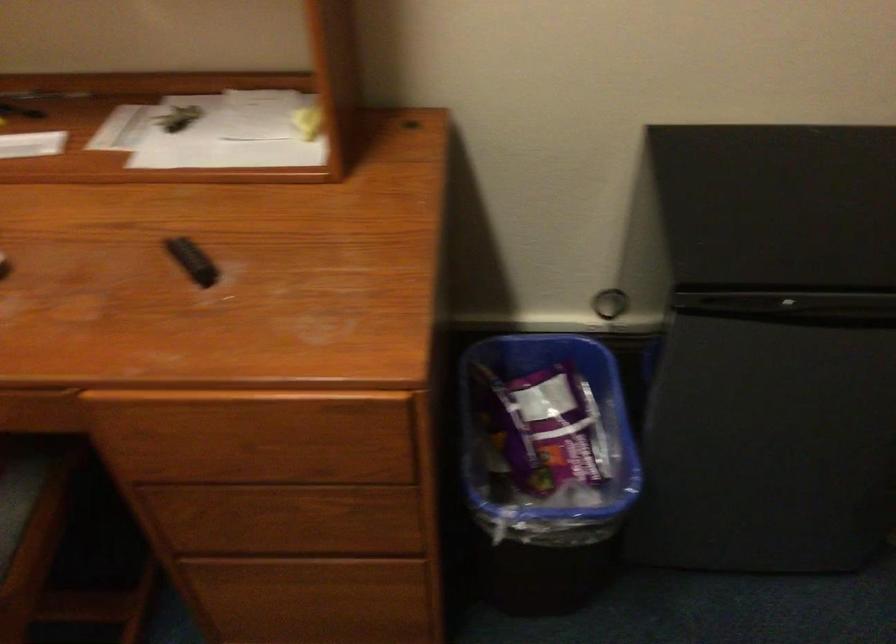
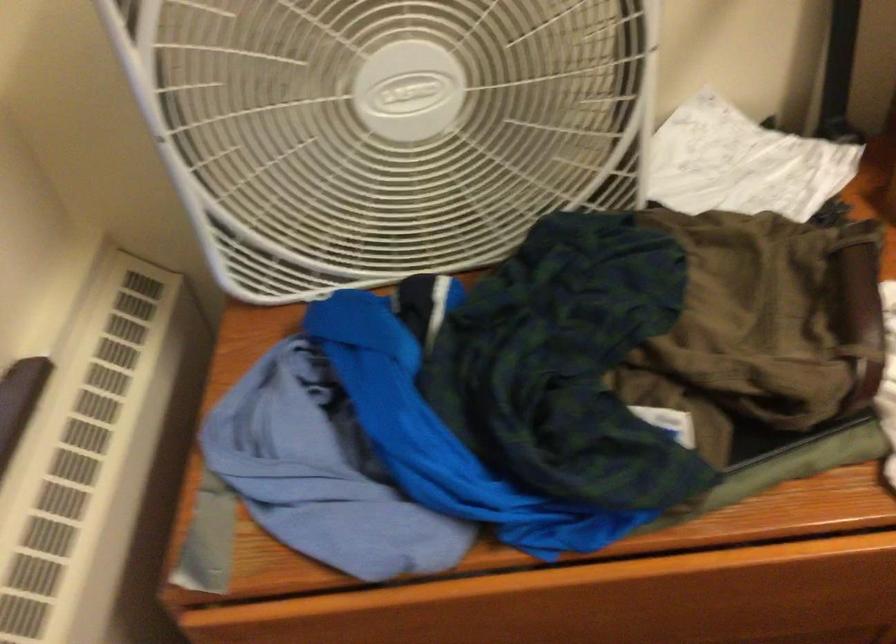
Question: In a continuous first-person perspective shot, in which direction is the camera moving?

Choices:
 (A) Left
 (B) Right
 (C) Forward
 (D) Backward

Answer: (A)